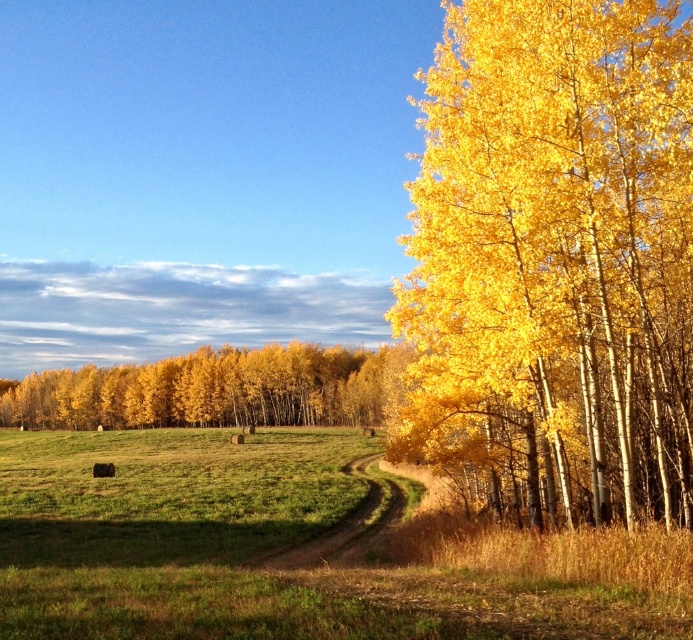
Question: Which of the following is the farthest from the observer?

Choices:
 (A) (651, 301)
 (B) (263, 376)
 (C) (362, 515)

Answer: (B)

Question: Which object is the closest to the golden yellow leaves at center?

Choices:
 (A) golden yellow leaves at right
 (B) brown dirt path at center

Answer: (B)

Question: Does golden yellow leaves at right appear over golden yellow leaves at center?

Choices:
 (A) yes
 (B) no

Answer: (A)

Question: Does golden yellow leaves at right appear under golden yellow leaves at center?

Choices:
 (A) yes
 (B) no

Answer: (B)

Question: Which point is closer to the camera?

Choices:
 (A) golden yellow leaves at center
 (B) golden yellow leaves at right

Answer: (B)

Question: Is golden yellow leaves at right to the left of golden yellow leaves at center from the viewer's perspective?

Choices:
 (A) no
 (B) yes

Answer: (A)